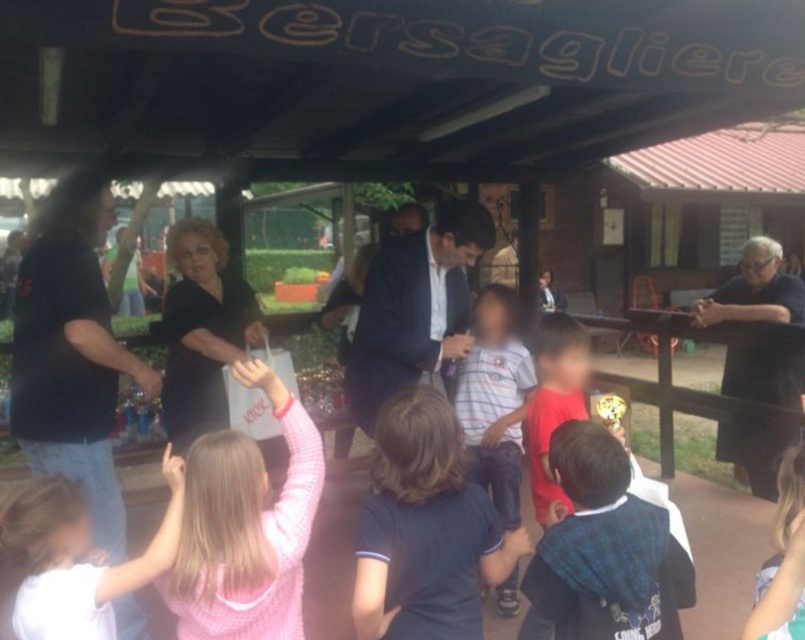
Can you confirm if pink fleece sweater at lower left is taller than dark blue textured shirt at center?

Indeed, pink fleece sweater at lower left has a greater height compared to dark blue textured shirt at center.

Does pink fleece sweater at lower left have a lesser height compared to dark blue textured shirt at center?

In fact, pink fleece sweater at lower left may be taller than dark blue textured shirt at center.

Between point (234, 618) and point (640, 582), which one is positioned behind?

Positioned behind is point (234, 618).

I want to click on pink fleece sweater at lower left, so pos(246,528).

Does pink fleece sweater at lower left have a larger size compared to dark blue suit at center?

No, pink fleece sweater at lower left is not bigger than dark blue suit at center.

Which is above, pink fleece sweater at lower left or dark blue suit at center?

dark blue suit at center is higher up.

Does point (250, 573) lie in front of point (362, 397)?

That is True.

Image resolution: width=805 pixels, height=640 pixels. I want to click on pink fleece sweater at lower left, so click(x=246, y=528).

Who is positioned more to the right, pink fleece sweater at lower left or striped cotton shirt at center?

From the viewer's perspective, striped cotton shirt at center appears more on the right side.

Measure the distance between point (240, 593) and camera.

A distance of 5.72 feet exists between point (240, 593) and camera.

Locate an element on the screen. Image resolution: width=805 pixels, height=640 pixels. pink fleece sweater at lower left is located at coordinates (246, 528).